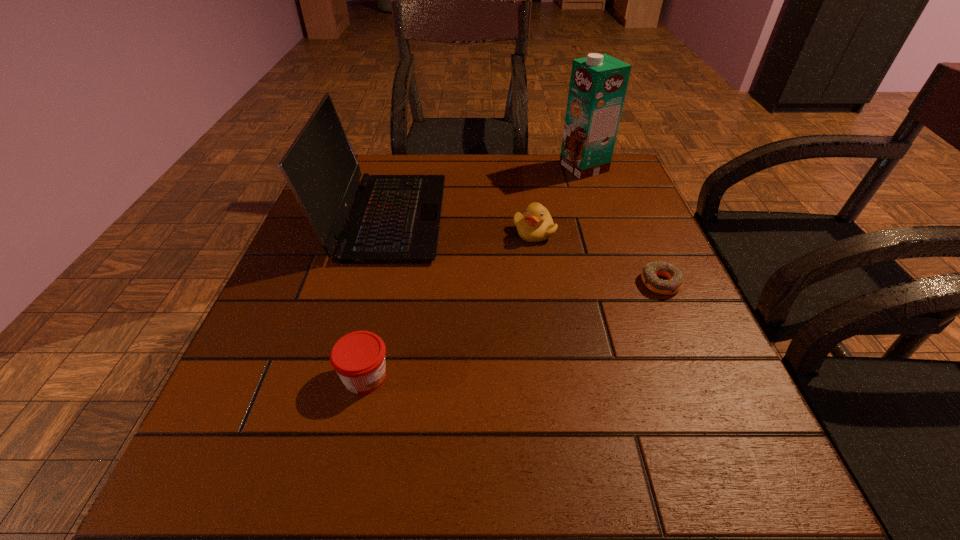
Locate an element on the screen. The width and height of the screenshot is (960, 540). the tallest object is located at coordinates (598, 83).

Identify the location of the farthest object. (598, 83).

What are the coordinates of `laptop computer` in the screenshot? It's located at pyautogui.click(x=394, y=218).

Locate an element on the screen. This screenshot has height=540, width=960. duckling is located at coordinates (535, 225).

This screenshot has width=960, height=540. Identify the location of the nearest object. (358, 358).

I want to click on doughnut, so click(x=650, y=272).

Image resolution: width=960 pixels, height=540 pixels. I want to click on the shortest object, so click(650, 272).

Identify the location of free region located on the front of the farthest object. (623, 281).

Where is `free space located 0.230m on the screen of the laptop computer`? free space located 0.230m on the screen of the laptop computer is located at coordinates (539, 218).

The width and height of the screenshot is (960, 540). Find the location of `blank space located 0.160m on the beak of the duckling`. blank space located 0.160m on the beak of the duckling is located at coordinates coord(543,297).